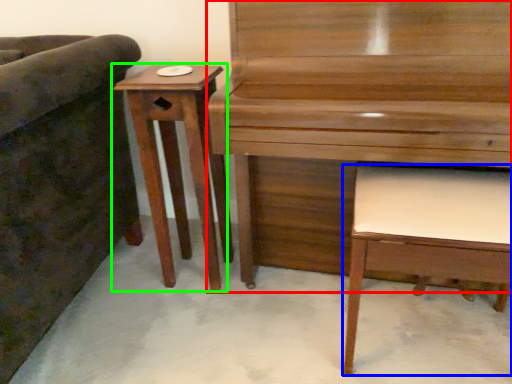
Question: Which object is the farthest from piano (highlighted by a red box)? Choose among these: music stool (highlighted by a blue box) or table (highlighted by a green box).

Choices:
 (A) music stool
 (B) table

Answer: (B)